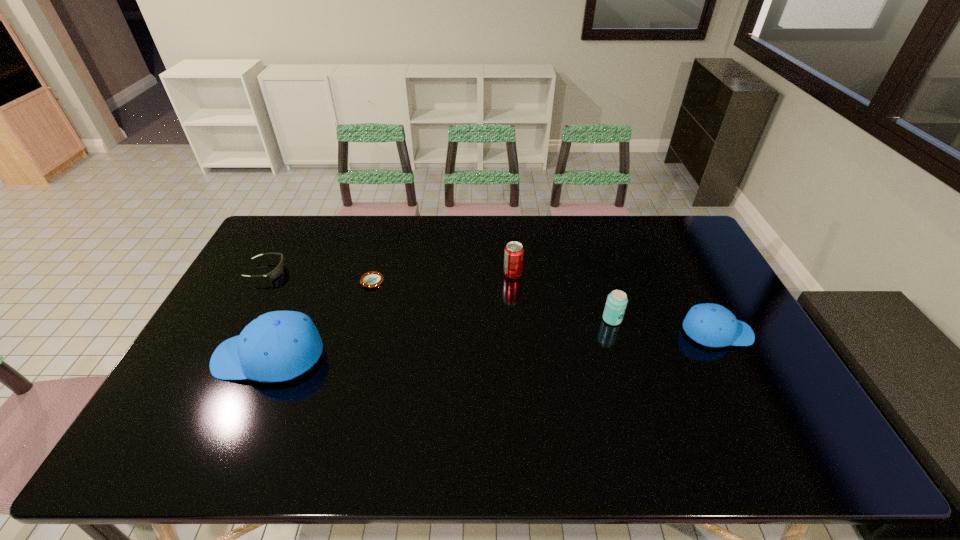
Locate an element on the screen. The image size is (960, 540). free spot between the second object from right to left and the soda is located at coordinates tap(563, 297).

Find the location of `vacant area between the beer can and the left cap`. vacant area between the beer can and the left cap is located at coordinates (441, 338).

Locate an element on the screen. This screenshot has width=960, height=540. object that is the closest to the fifth object from left to right is located at coordinates click(x=712, y=325).

At what (x,y) coordinates should I click in order to perform the action: click on object that is the fifth closest to the shortest object. Please return your answer as a coordinate pair (x, y). Looking at the image, I should click on (712, 325).

The image size is (960, 540). I want to click on vacant space that satisfies the following two spatial constraints: 1. on the lenses of the second object from right to left; 2. on the left side of the second shortest object, so click(240, 319).

The image size is (960, 540). Find the location of `vacant region that satisfies the following two spatial constraints: 1. on the lenses of the fourth object from left to right; 2. on the left side of the fifth tallest object`. vacant region that satisfies the following two spatial constraints: 1. on the lenses of the fourth object from left to right; 2. on the left side of the fifth tallest object is located at coordinates point(265,274).

This screenshot has width=960, height=540. I want to click on vacant space that satisfies the following two spatial constraints: 1. on the front side of the beer can; 2. on the right side of the fourth object from left to right, so click(x=516, y=319).

The height and width of the screenshot is (540, 960). I want to click on vacant region that satisfies the following two spatial constraints: 1. on the front side of the soda; 2. on the front-facing side of the left cap, so click(x=519, y=356).

Find the location of a particular element. This screenshot has width=960, height=540. free location that satisfies the following two spatial constraints: 1. on the lenses of the goggles; 2. on the left side of the compass is located at coordinates (261, 282).